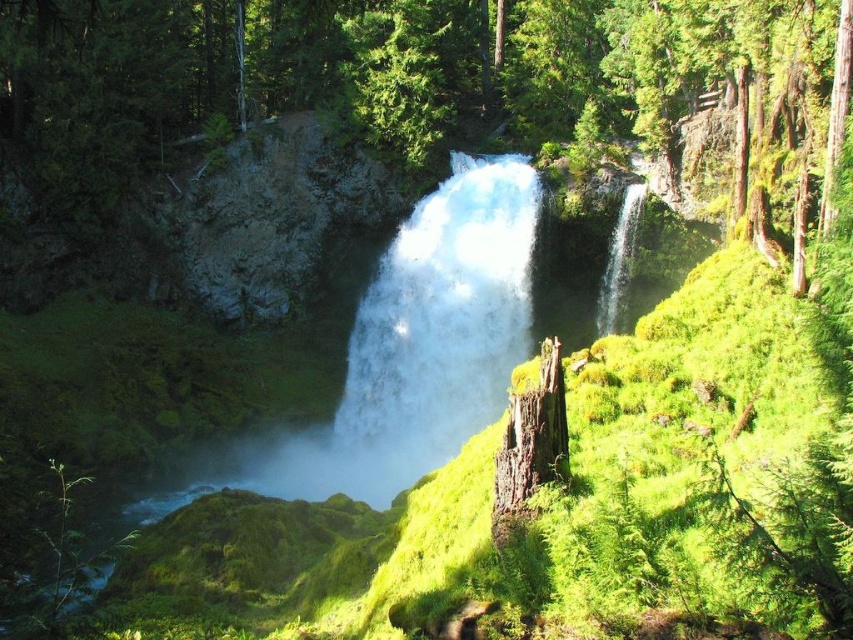
The image size is (853, 640). In order to click on green mossy tree stump at center in this screenshot , I will do `click(402, 77)`.

Is green mossy tree stump at center below white frothy water at center?

No.

Locate an element on the screen. green mossy tree stump at center is located at coordinates (402, 77).

What do you see at coordinates (444, 314) in the screenshot?
I see `white frothy water at center` at bounding box center [444, 314].

Which of these two, white frothy water at center or brown rough wood stump at center, stands shorter?

With less height is brown rough wood stump at center.

Does point (498, 240) lie behind point (563, 417)?

That is True.

The width and height of the screenshot is (853, 640). In order to click on white frothy water at center in this screenshot , I will do `click(444, 314)`.

Based on the photo, can you confirm if green mossy tree stump at center is positioned to the left of brown rough wood stump at center?

Yes, green mossy tree stump at center is to the left of brown rough wood stump at center.

Between point (581, 36) and point (548, 454), which one is positioned behind?

The point (581, 36) is more distant.

I want to click on green mossy tree stump at center, so click(402, 77).